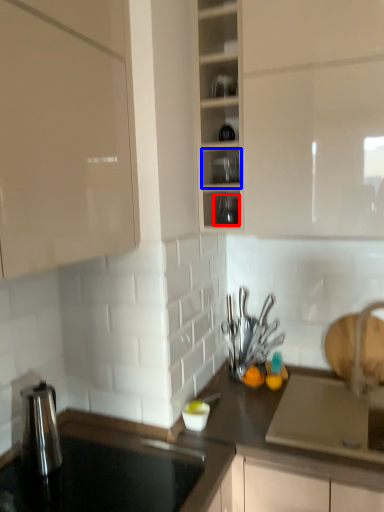
Question: Which object appears farthest to the camera in this image, tableware (highlighted by a red box) or shelf (highlighted by a blue box)?

Choices:
 (A) tableware
 (B) shelf

Answer: (A)